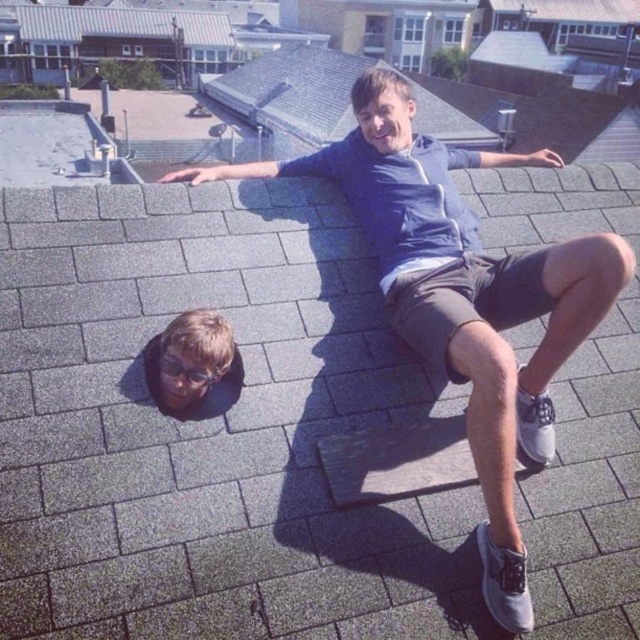
Question: Can you confirm if matte blue hoodie at upper center is wider than blonde hair at lower left?

Choices:
 (A) yes
 (B) no

Answer: (A)

Question: Which point is farther to the camera?

Choices:
 (A) (188, 348)
 (B) (394, 160)

Answer: (B)

Question: Can you confirm if matte blue hoodie at upper center is thinner than blonde hair at lower left?

Choices:
 (A) no
 (B) yes

Answer: (A)

Question: From the image, what is the correct spatial relationship of matte blue hoodie at upper center in relation to blonde hair at lower left?

Choices:
 (A) left
 (B) right

Answer: (B)

Question: Which point appears farthest from the camera in this image?

Choices:
 (A) (177, 330)
 (B) (440, 228)

Answer: (B)